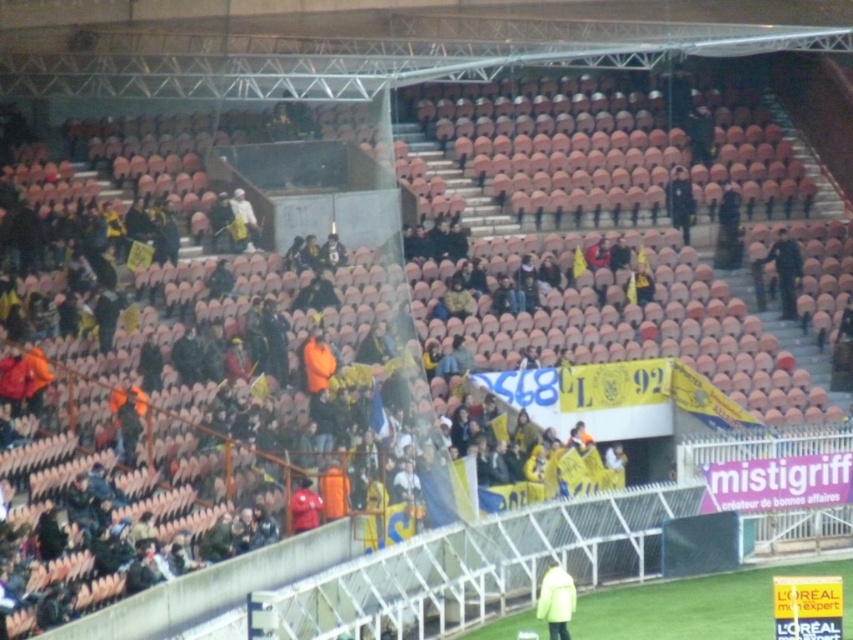
You are a photographer positioned at the edge of the field. You need to capture both the yellow matte jacket at center and the black uniform at center in your shot. Which one will appear smaller in the photo?

The yellow matte jacket at center will appear smaller in the photo because it has a lesser height compared to the black uniform at center.

You are a drone operator trying to capture a live shot of the yellow matte jacket at center during the event. The stadium has a restricted airspace zone at point [556,600]. Can you safely fly your drone over the yellow matte jacket at center without entering the restricted zone?

The yellow matte jacket at center is located at point [556,600], which is the restricted airspace zone. Therefore, you cannot safely fly your drone over the yellow matte jacket at center without entering the restricted zone.